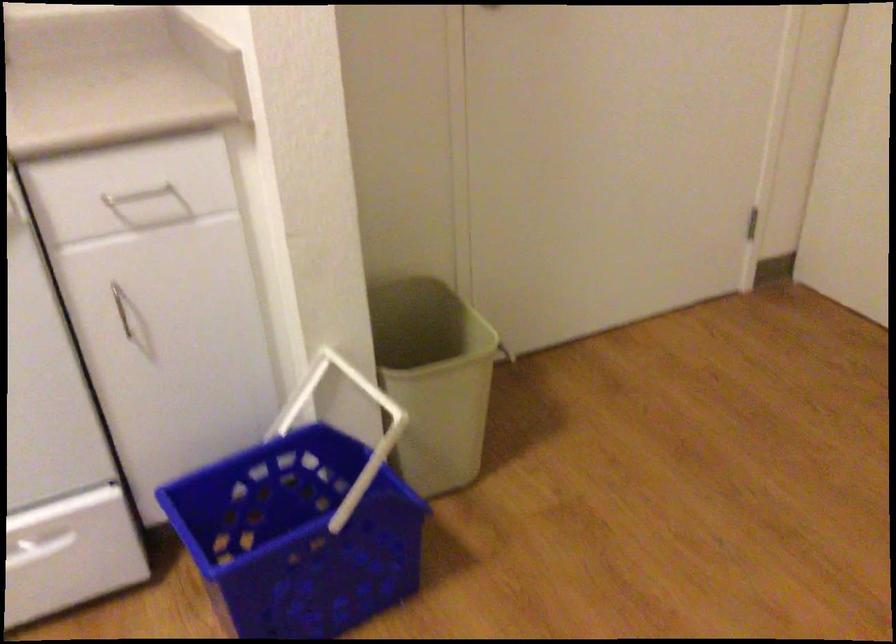
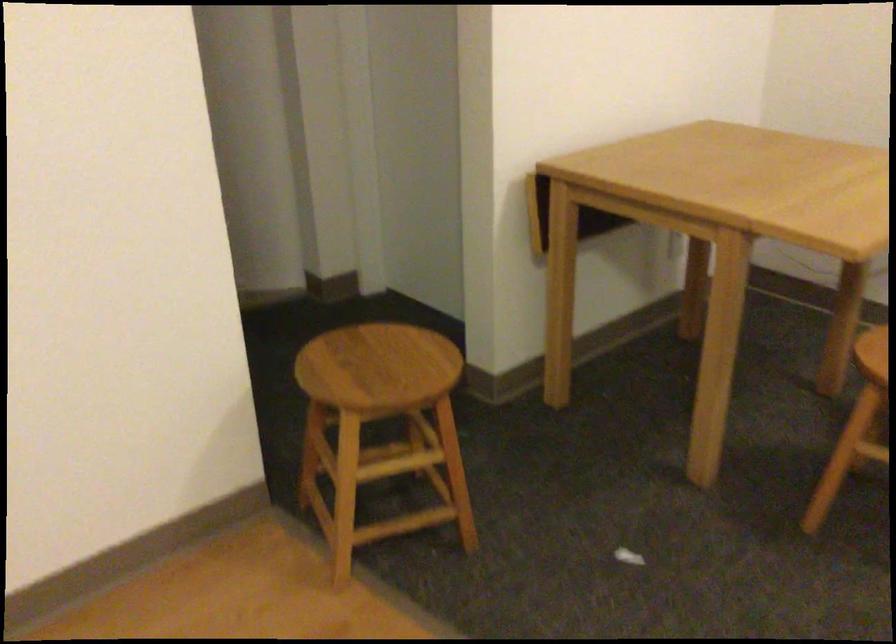
First-person continuous shooting, in which direction is the camera rotating?

The rotation direction of the camera is right-down.